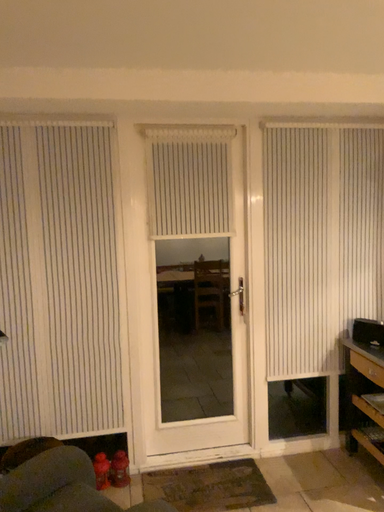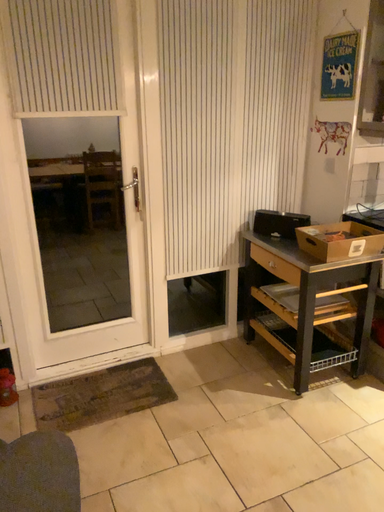
Question: How did the camera likely rotate when shooting the video?

Choices:
 (A) rotated downward
 (B) rotated upward

Answer: (A)